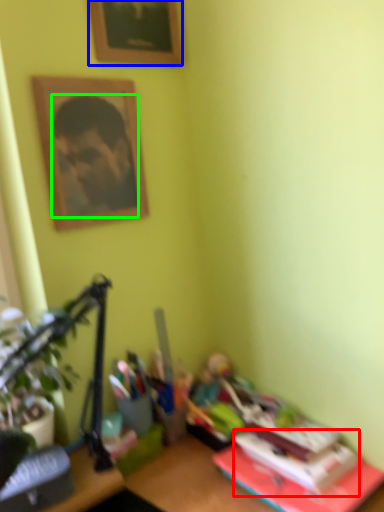
Question: Considering the real-world distances, which object is farthest from paperback book (highlighted by a red box)? picture frame (highlighted by a blue box) or man (highlighted by a green box)?

Choices:
 (A) picture frame
 (B) man

Answer: (A)